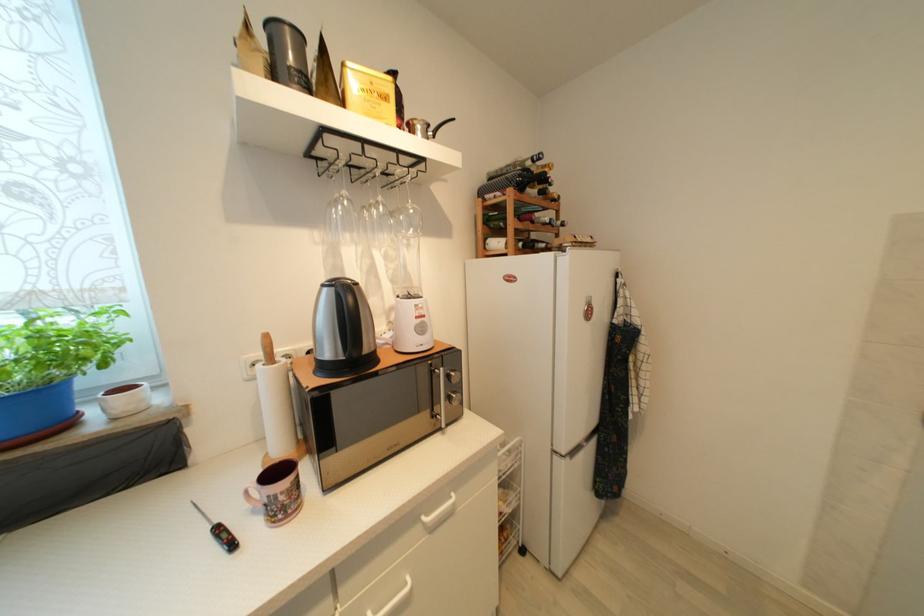
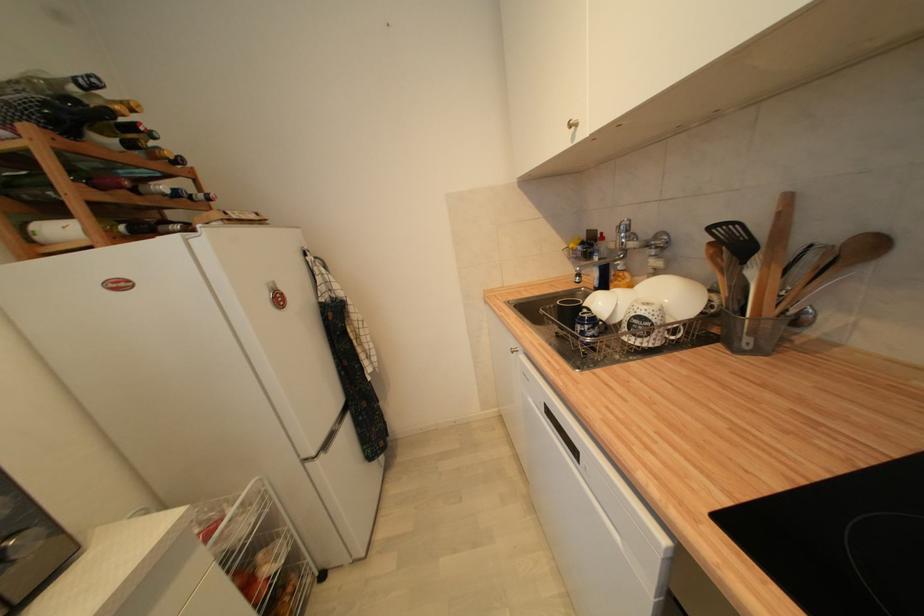
Where in the second image is the point corresponding to (x=568, y=455) from the first image?

(319, 456)